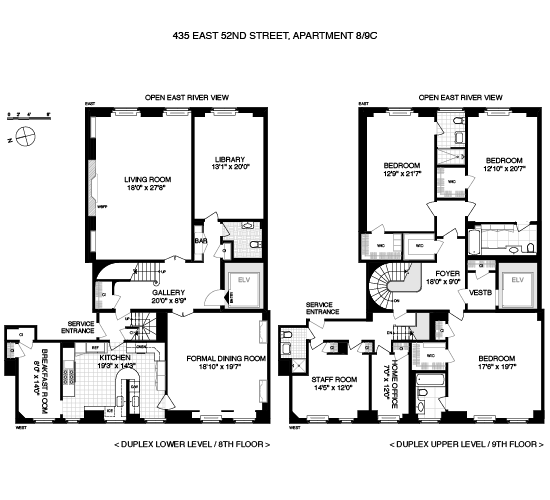
I want to click on elevator area, so click(x=516, y=296), click(x=245, y=292).